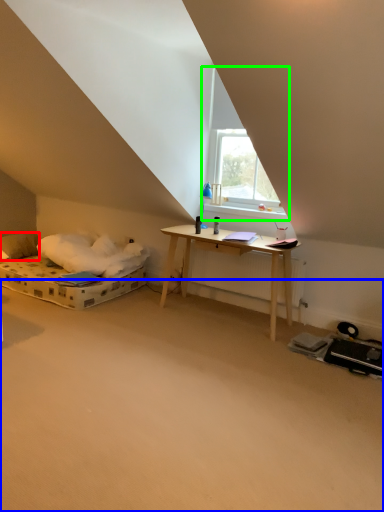
Question: Which object is positioned farthest from pillow (highlighted by a red box)? Select from plain (highlighted by a blue box) and window (highlighted by a green box).

Choices:
 (A) plain
 (B) window

Answer: (A)